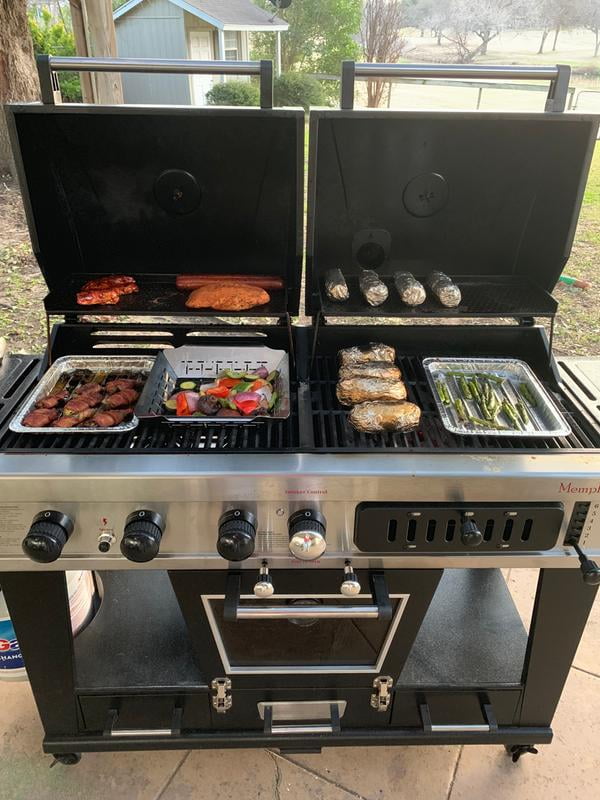
The image size is (600, 800). Find the location of `knob`. knob is located at coordinates (353, 589).